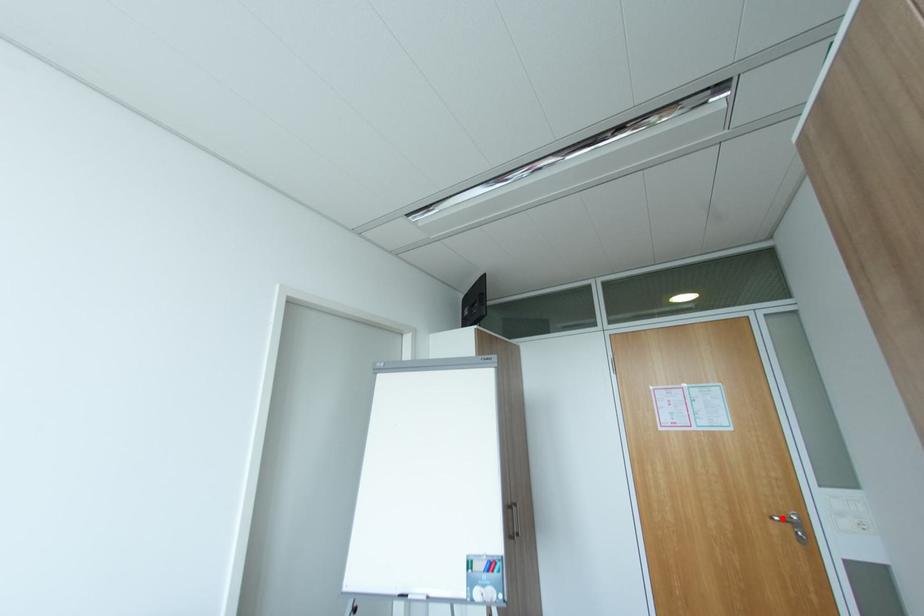
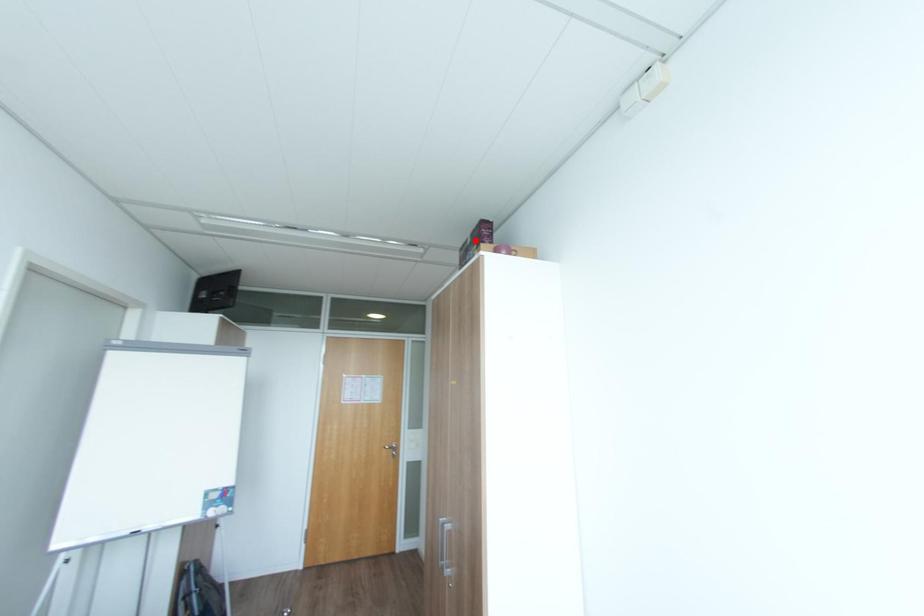
I am providing you with two images of the same scene from different viewpoints. A red point is marked on the first image and another point is marked on the second image. Does the point marked in image1 correspond to the same location as the one in image2?

No